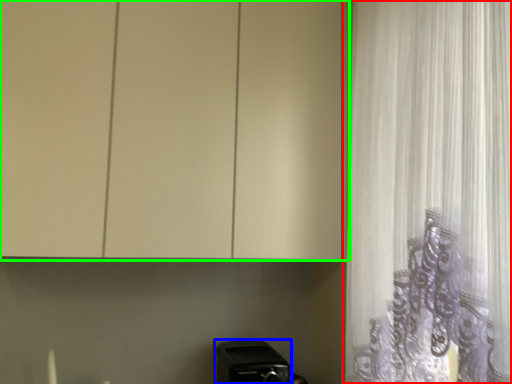
Question: Which object is positioned farthest from curtain (highlighted by a red box)? Select from appliance (highlighted by a blue box) and cabinetry (highlighted by a green box).

Choices:
 (A) appliance
 (B) cabinetry

Answer: (A)